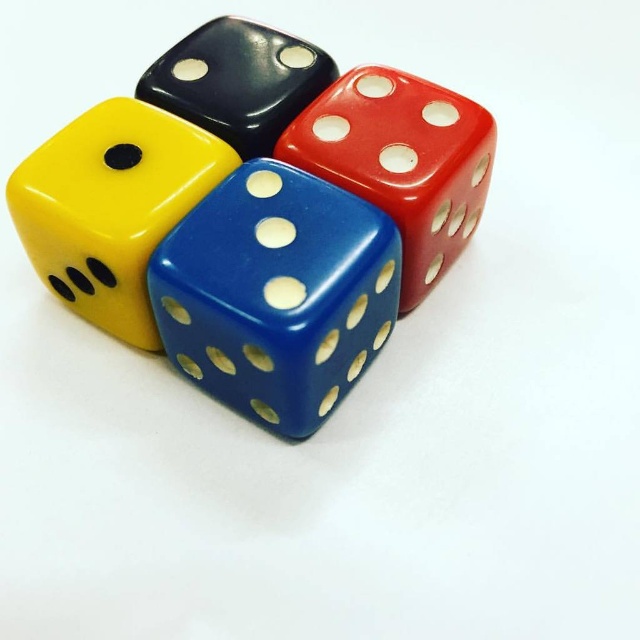
Question: Among these objects, which one is farthest from the camera?

Choices:
 (A) glossy plastic dice at center
 (B) red glossy dice at center
 (C) black glossy dice at upper center

Answer: (C)

Question: Can you confirm if glossy plastic dice at center is smaller than red glossy dice at center?

Choices:
 (A) no
 (B) yes

Answer: (A)

Question: Which object appears closest to the camera in this image?

Choices:
 (A) red glossy dice at center
 (B) yellow glossy dice at center

Answer: (B)

Question: Which point is closer to the camera?

Choices:
 (A) glossy plastic dice at center
 (B) yellow glossy dice at center
 (C) red glossy dice at center
 (D) black glossy dice at upper center

Answer: (A)

Question: Does glossy plastic dice at center lie behind black glossy dice at upper center?

Choices:
 (A) no
 (B) yes

Answer: (A)

Question: Is yellow glossy dice at center wider than red glossy dice at center?

Choices:
 (A) yes
 (B) no

Answer: (B)